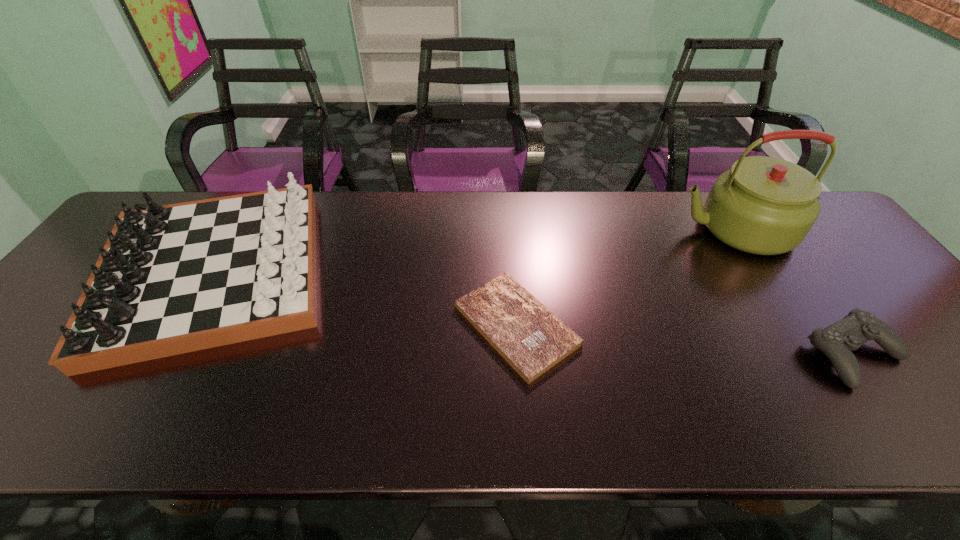
You are a GUI agent. You are given a task and a screenshot of the screen. Output one action in this format:
    pyautogui.click(x=<x>, y=<y>)
    Task: Click on the tallest object
    This screenshot has width=960, height=540.
    Given the screenshot: What is the action you would take?
    pyautogui.click(x=763, y=205)

This screenshot has width=960, height=540. Find the location of `gameboard`. gameboard is located at coordinates (172, 279).

Locate an element on the screen. This screenshot has width=960, height=540. the second tallest object is located at coordinates (172, 279).

The width and height of the screenshot is (960, 540). Identify the location of control. (836, 341).

Where is `the third object from right to left`? This screenshot has width=960, height=540. the third object from right to left is located at coordinates (532, 340).

This screenshot has width=960, height=540. What are the coordinates of `the shortest object` in the screenshot? It's located at (532, 340).

The height and width of the screenshot is (540, 960). I want to click on vacant region located 0.300m at the spout of the tallest object, so click(572, 230).

Image resolution: width=960 pixels, height=540 pixels. I want to click on vacant space located at the spout of the tallest object, so click(610, 230).

I want to click on free space located at the spout of the tallest object, so click(x=552, y=230).

Find the location of `free space located on the right of the gameboard`. free space located on the right of the gameboard is located at coordinates (459, 272).